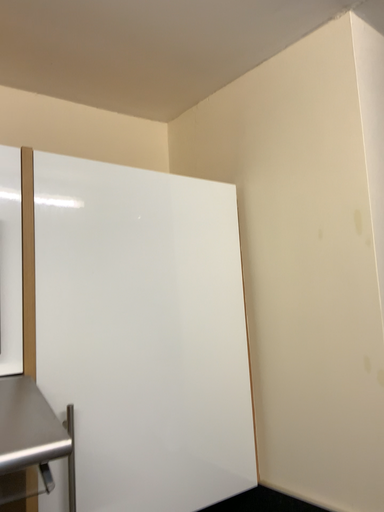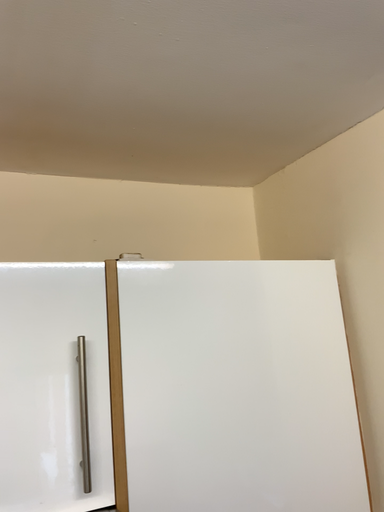
Question: How did the camera likely rotate when shooting the video?

Choices:
 (A) rotated left
 (B) rotated right

Answer: (A)